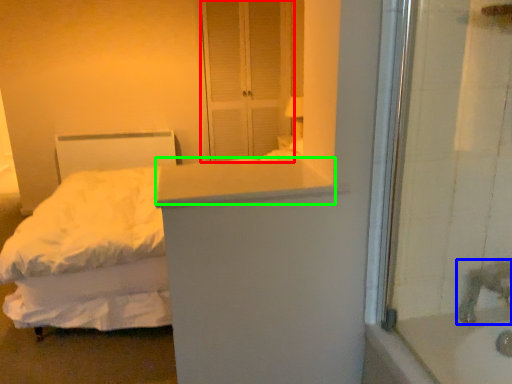
Question: Which is nearer to the screen door (highlighted by a red box)? faucet (highlighted by a blue box) or counter top (highlighted by a green box).

Choices:
 (A) faucet
 (B) counter top

Answer: (B)